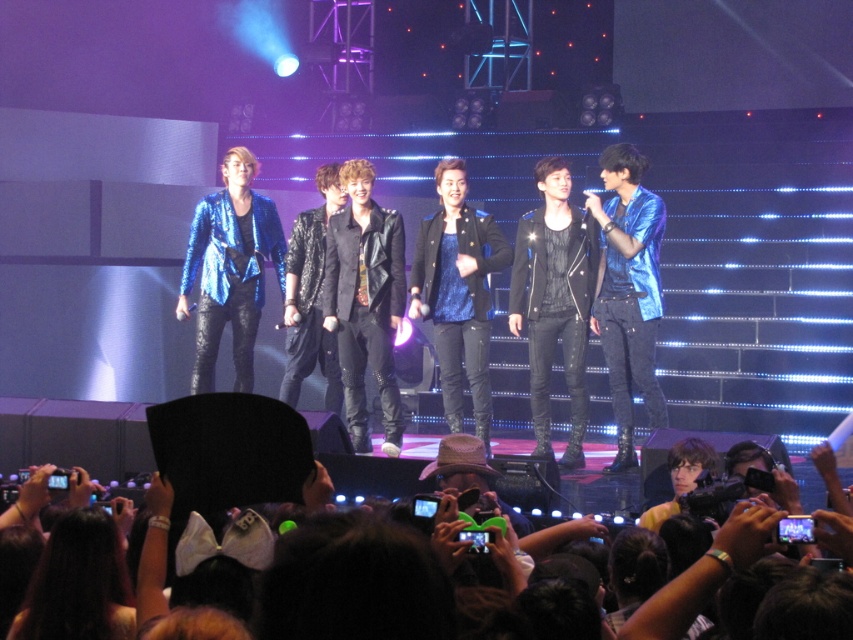
Question: Which of the following is the farthest from the observer?

Choices:
 (A) black fabric hat at lower center
 (B) shiny metallic jackets at center

Answer: (B)

Question: Which point is farther to the camera?

Choices:
 (A) (608, 314)
 (B) (708, 561)
 (C) (558, 241)

Answer: (C)

Question: Is shiny metallic jackets at center thinner than shiny blue jacket at right?

Choices:
 (A) yes
 (B) no

Answer: (B)

Question: Observing the image, what is the correct spatial positioning of shiny metallic jackets at center in reference to shiny blue jacket at right?

Choices:
 (A) right
 (B) left

Answer: (B)

Question: Does shiny metallic jackets at center have a smaller size compared to black fabric hat at lower center?

Choices:
 (A) no
 (B) yes

Answer: (A)

Question: Which object is the closest to the black fabric hat at lower center?

Choices:
 (A) shiny metallic jackets at center
 (B) shiny blue jacket at right

Answer: (B)